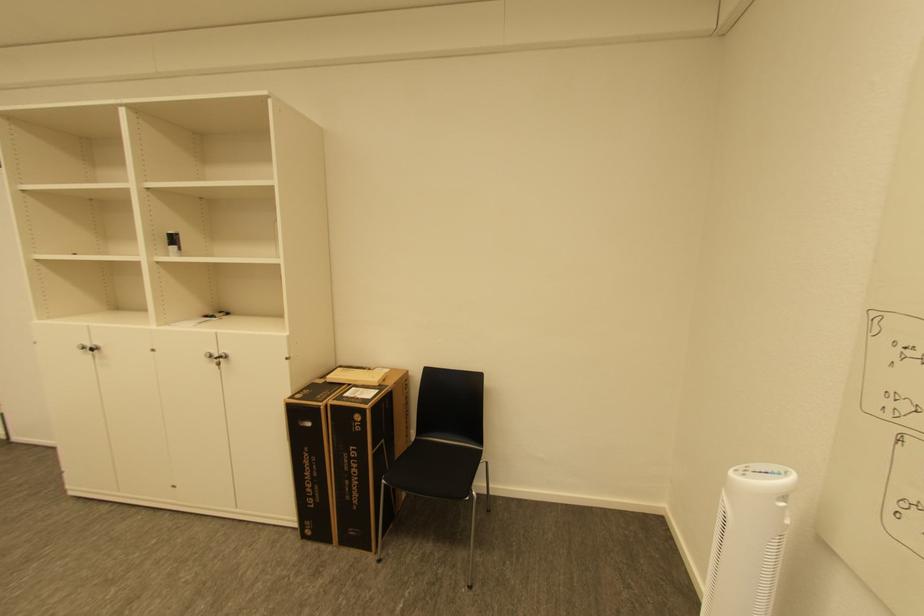
This screenshot has height=616, width=924. I want to click on cardboard box handle, so click(x=305, y=427).